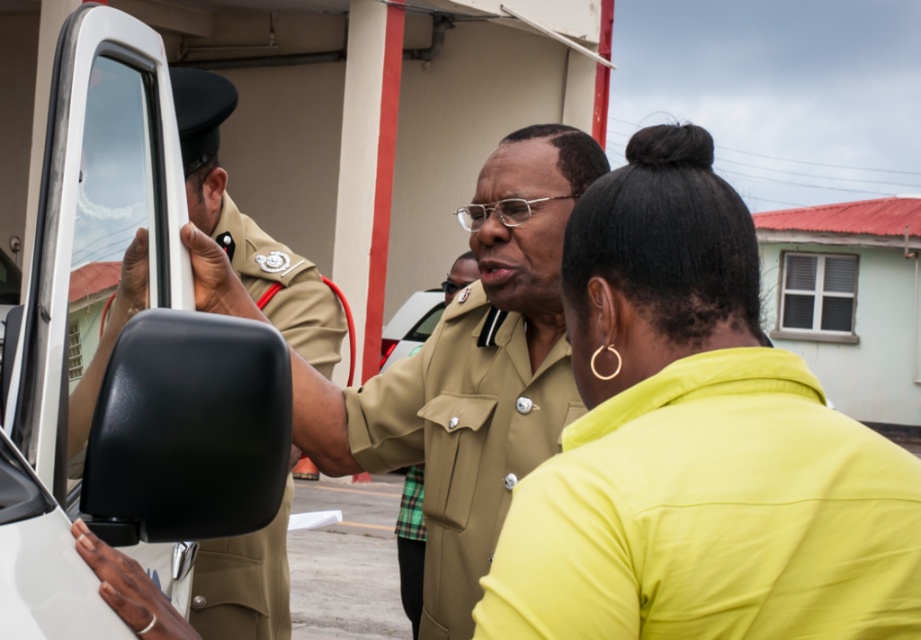
Question: Which of these objects is positioned farthest from the matte khaki uniform at left?

Choices:
 (A) kaki fabric uniform at center
 (B) yellow matte shirt at center
 (C) satin khaki uniform at left

Answer: (B)

Question: Is yellow matte shirt at center wider than satin khaki uniform at left?

Choices:
 (A) yes
 (B) no

Answer: (A)

Question: In this image, where is yellow matte shirt at center located relative to satin khaki uniform at left?

Choices:
 (A) above
 (B) below

Answer: (B)

Question: Which object is the farthest from the matte khaki uniform at left?

Choices:
 (A) kaki fabric uniform at center
 (B) yellow matte shirt at center

Answer: (B)

Question: Is yellow matte shirt at center wider than kaki fabric uniform at center?

Choices:
 (A) no
 (B) yes

Answer: (A)

Question: Which object is the closest to the kaki fabric uniform at center?

Choices:
 (A) yellow matte shirt at center
 (B) satin khaki uniform at left

Answer: (B)